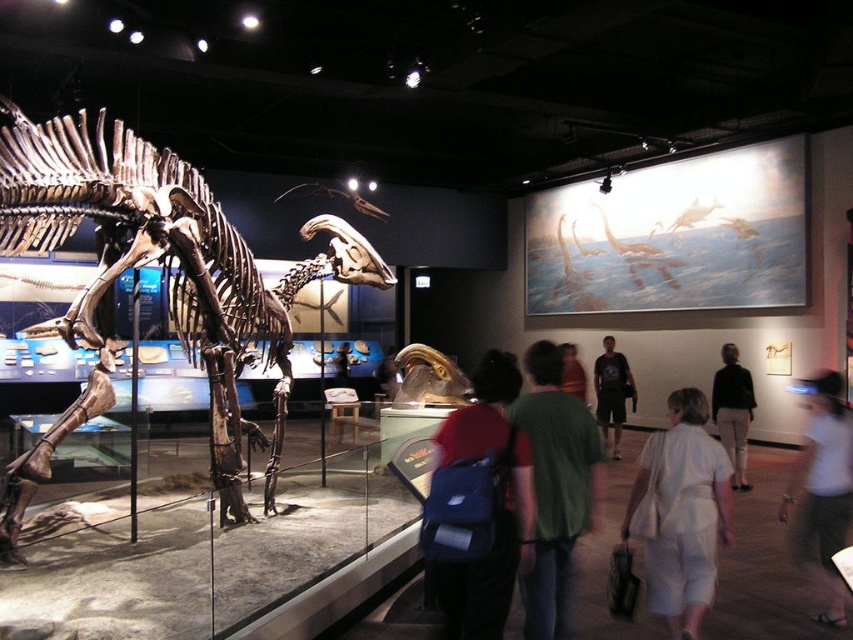
You are standing in the museum and want to take a photo of the dinosaur skeleton. The camera you are using has a focal length of 50mm and a sensor size of 24mm x 36mm. The point at coordinates point (721, 387) in the image corresponds to the dinosaur skeleton. What is the closest distance you can stand to the dinosaur skeleton to ensure the entire skeleton fits within the camera frame?

The distance of point (721, 387) from camera is 8.36 meters. To ensure the entire dinosaur skeleton fits within the camera frame, you must stand at least 8.36 meters away from the skeleton.

You are a visitor at the museum and you see the light beige pants at center and the light brown leather jacket at center. Which one is closer to the floor?

The light beige pants at center is positioned under light brown leather jacket at center, so the light beige pants at center is closer to the floor.